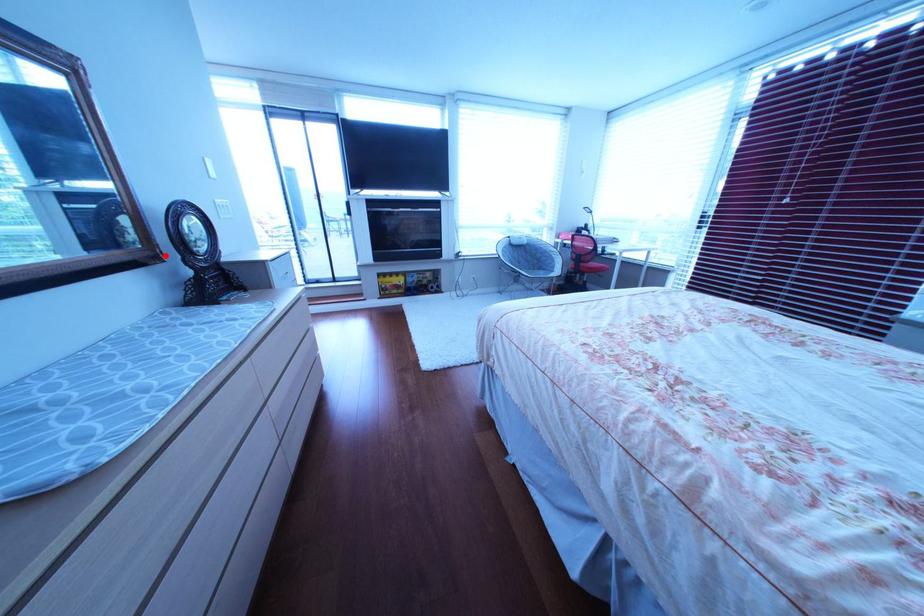
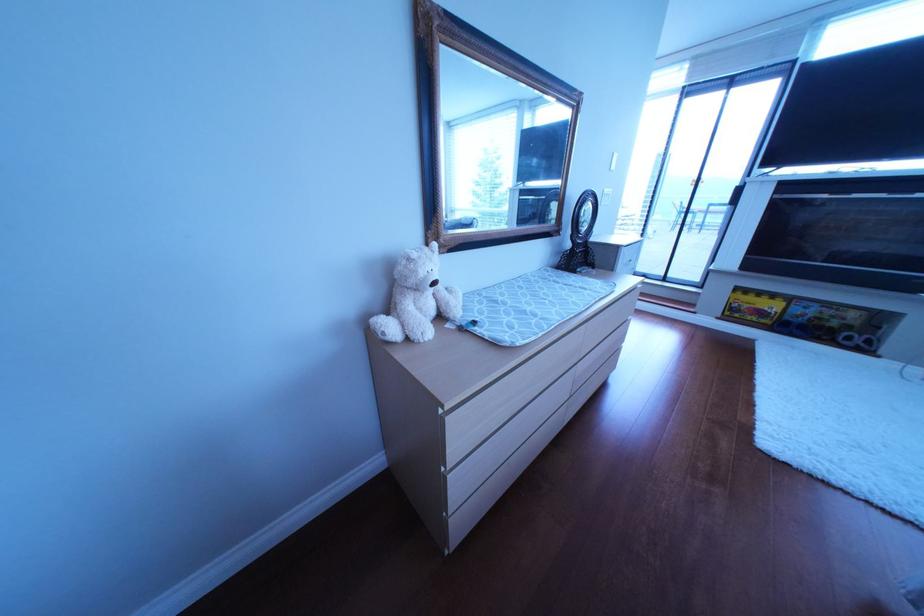
Where in the second image is the point corresponding to the highlighted location from the first image?

(573, 230)